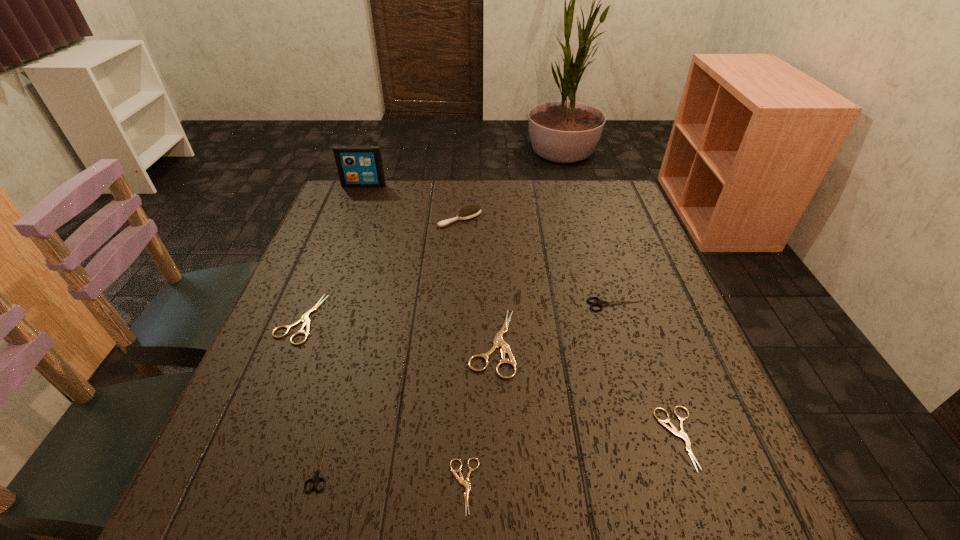
Where is `unoccupied area between the seventh shortest object and the smallest beige shears`? The height and width of the screenshot is (540, 960). unoccupied area between the seventh shortest object and the smallest beige shears is located at coordinates (462, 353).

Identify the location of vacant space that is in between the rightmost beige shears and the third smallest beige shears. The height and width of the screenshot is (540, 960). (490, 379).

What are the coordinates of `free area in between the iPod and the rightmost beige shears` in the screenshot? It's located at (521, 312).

Locate an element on the screen. free space that is in between the second farthest object and the right black shears is located at coordinates (538, 262).

At what (x,y) coordinates should I click in order to perform the action: click on object that is the sixth closest to the shortest object. Please return your answer as a coordinate pair (x, y). The image size is (960, 540). Looking at the image, I should click on (471, 211).

Identify the location of object that stands as the fifth closest to the farthest object. Image resolution: width=960 pixels, height=540 pixels. (316, 478).

Where is `shears that stands as the closest to the third biggest beige shears`? The image size is (960, 540). shears that stands as the closest to the third biggest beige shears is located at coordinates (600, 303).

Point out which shears is positioned as the fifth nearest to the farther black shears. Please provide its 2D coordinates. Your answer should be formatted as a tuple, i.e. [(x, y)], where the tuple contains the x and y coordinates of a point satisfying the conditions above.

[(305, 319)]

This screenshot has height=540, width=960. Identify the location of the closest beige shears to the bigger black shears. (498, 341).

This screenshot has height=540, width=960. In order to click on beige shears object that ranks as the third closest to the tallest object in this screenshot , I will do `click(465, 483)`.